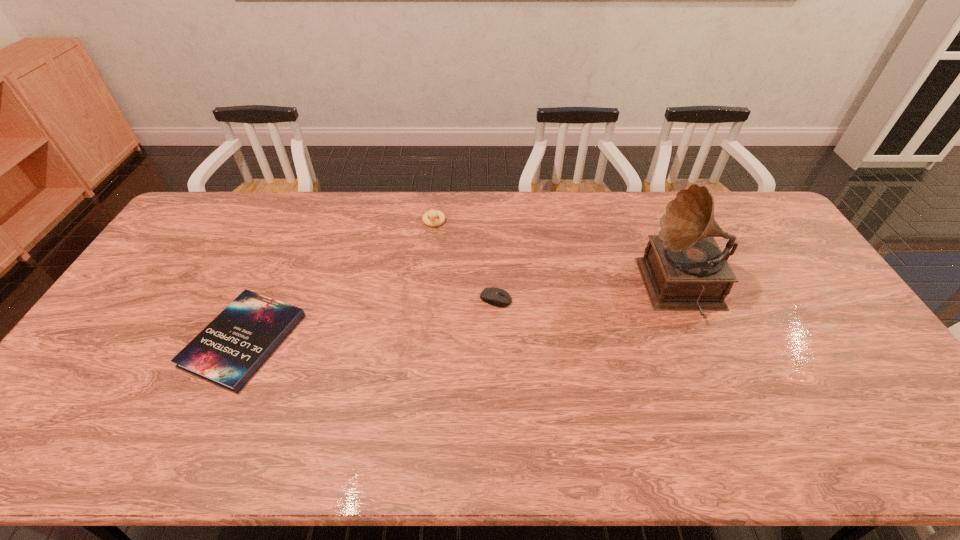
The width and height of the screenshot is (960, 540). I want to click on vacant area that lies between the rightmost object and the hardback book, so click(x=464, y=314).

At what (x,y) coordinates should I click in order to perform the action: click on free space between the record player and the duckling. Please return your answer as a coordinate pair (x, y). Looking at the image, I should click on (559, 255).

Where is `free space that is in between the second object from left to right and the record player`? free space that is in between the second object from left to right and the record player is located at coordinates (559, 255).

At what (x,y) coordinates should I click in order to perform the action: click on empty space that is in between the rightmost object and the leftmost object. Please return your answer as a coordinate pair (x, y). This screenshot has width=960, height=540. Looking at the image, I should click on pyautogui.click(x=464, y=314).

Locate an element on the screen. Image resolution: width=960 pixels, height=540 pixels. empty space between the second object from right to left and the leftmost object is located at coordinates (370, 319).

The height and width of the screenshot is (540, 960). I want to click on vacant space that is in between the computer equipment and the second object from left to right, so click(465, 260).

Identify the location of free area in between the leftmost object and the duckling. This screenshot has height=540, width=960. (339, 281).

Locate an element on the screen. vacant area that lies between the duckling and the computer equipment is located at coordinates (465, 260).

Where is `object that is the closest to the second tallest object`? object that is the closest to the second tallest object is located at coordinates (497, 297).

You are a GUI agent. You are given a task and a screenshot of the screen. Output one action in this format:
    pyautogui.click(x=<x>, y=<y>)
    Task: Click on the object identified as the second closest to the duckling
    Image resolution: width=960 pixels, height=540 pixels.
    Given the screenshot: What is the action you would take?
    pos(230,349)